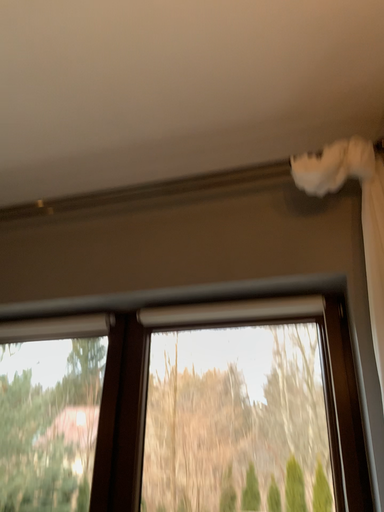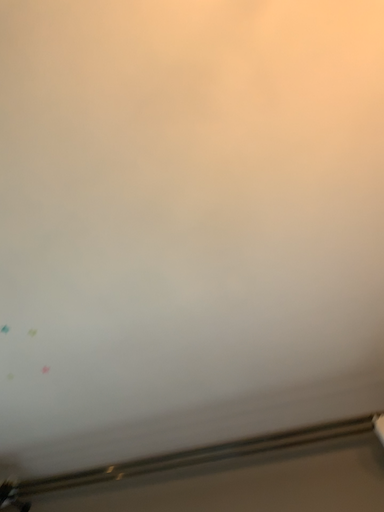
Question: How did the camera likely rotate when shooting the video?

Choices:
 (A) rotated right
 (B) rotated left

Answer: (B)